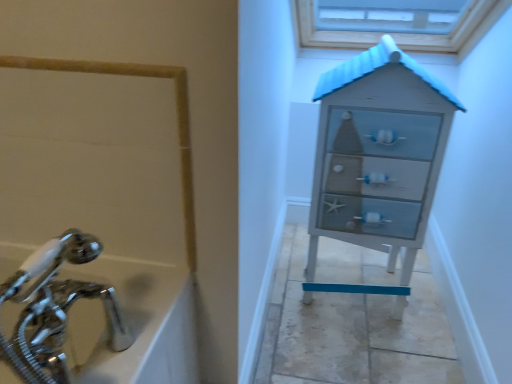
This screenshot has height=384, width=512. Describe the element at coordinates (378, 153) in the screenshot. I see `distressed white chest of drawers at right` at that location.

In order to click on distressed white chest of drawers at right in this screenshot , I will do `click(378, 153)`.

Based on the photo, in order to face chrome metallic faucet at lower left, should I rotate leftwards or rightwards?

Rotate your view left by about 20.718°.

Find the location of `chrome metallic faucet at lower left`. chrome metallic faucet at lower left is located at coordinates (55, 309).

What do you see at coordinates (55, 309) in the screenshot? I see `chrome metallic faucet at lower left` at bounding box center [55, 309].

I want to click on distressed white chest of drawers at right, so click(x=378, y=153).

Is distressed white chest of drawers at right to the left of chrome metallic faucet at lower left from the viewer's perspective?

In fact, distressed white chest of drawers at right is to the right of chrome metallic faucet at lower left.

Who is more distant, distressed white chest of drawers at right or chrome metallic faucet at lower left?

distressed white chest of drawers at right is behind.

Considering the points (326, 194) and (42, 293), which point is behind, point (326, 194) or point (42, 293)?

The point (326, 194) is behind.

From the image's perspective, who appears lower, distressed white chest of drawers at right or chrome metallic faucet at lower left?

chrome metallic faucet at lower left.

Consider the image. From a real-world perspective, does distressed white chest of drawers at right stand above chrome metallic faucet at lower left?

Incorrect, from a real-world perspective, distressed white chest of drawers at right is lower than chrome metallic faucet at lower left.

Considering the sizes of distressed white chest of drawers at right and chrome metallic faucet at lower left in the image, is distressed white chest of drawers at right wider or thinner than chrome metallic faucet at lower left?

distressed white chest of drawers at right is wider than chrome metallic faucet at lower left.

Is distressed white chest of drawers at right taller or shorter than chrome metallic faucet at lower left?

In the image, distressed white chest of drawers at right appears to be taller than chrome metallic faucet at lower left.

Who is smaller, distressed white chest of drawers at right or chrome metallic faucet at lower left?

With smaller size is chrome metallic faucet at lower left.

Is distressed white chest of drawers at right positioned beyond the bounds of chrome metallic faucet at lower left?

Yes, distressed white chest of drawers at right is not within chrome metallic faucet at lower left.

Is distressed white chest of drawers at right touching chrome metallic faucet at lower left?

distressed white chest of drawers at right is not next to chrome metallic faucet at lower left, and they're not touching.

Is distressed white chest of drawers at right oriented towards chrome metallic faucet at lower left?

No, distressed white chest of drawers at right is not aimed at chrome metallic faucet at lower left.

In order to click on tap in front of the distressed white chest of drawers at right in this screenshot , I will do (55, 309).

Can you confirm if chrome metallic faucet at lower left is positioned to the right of distressed white chest of drawers at right?

In fact, chrome metallic faucet at lower left is to the left of distressed white chest of drawers at right.

Is chrome metallic faucet at lower left behind distressed white chest of drawers at right?

No, chrome metallic faucet at lower left is closer to the camera.

Does point (36, 326) lie behind point (317, 238)?

No, (36, 326) is closer to viewer.

From the image's perspective, who appears lower, chrome metallic faucet at lower left or distressed white chest of drawers at right?

chrome metallic faucet at lower left is shown below in the image.

From a real-world perspective, between chrome metallic faucet at lower left and distressed white chest of drawers at right, who is vertically lower?

distressed white chest of drawers at right is physically lower.

Does chrome metallic faucet at lower left have a greater width compared to distressed white chest of drawers at right?

No, chrome metallic faucet at lower left is not wider than distressed white chest of drawers at right.

From their relative heights in the image, would you say chrome metallic faucet at lower left is taller or shorter than distressed white chest of drawers at right?

Clearly, chrome metallic faucet at lower left is shorter compared to distressed white chest of drawers at right.

In terms of size, does chrome metallic faucet at lower left appear bigger or smaller than distressed white chest of drawers at right?

chrome metallic faucet at lower left is smaller than distressed white chest of drawers at right.

Choose the correct answer: Is chrome metallic faucet at lower left inside distressed white chest of drawers at right or outside it?

chrome metallic faucet at lower left lies outside distressed white chest of drawers at right.

Is the surface of chrome metallic faucet at lower left in direct contact with distressed white chest of drawers at right?

chrome metallic faucet at lower left and distressed white chest of drawers at right are not in contact.

Is distressed white chest of drawers at right at the back of chrome metallic faucet at lower left?

No, chrome metallic faucet at lower left's orientation is not away from distressed white chest of drawers at right.

Can you tell me how much chrome metallic faucet at lower left and distressed white chest of drawers at right differ in facing direction?

The angle between the facing direction of chrome metallic faucet at lower left and the facing direction of distressed white chest of drawers at right is 84.9 degrees.

Looking at this image, how far apart are chrome metallic faucet at lower left and distressed white chest of drawers at right?

chrome metallic faucet at lower left is 36.36 inches from distressed white chest of drawers at right.

The image size is (512, 384). In order to click on tap below the distressed white chest of drawers at right (from the image's perspective) in this screenshot , I will do `click(55, 309)`.

At what (x,y) coordinates should I click in order to perform the action: click on tap in front of the distressed white chest of drawers at right. Please return your answer as a coordinate pair (x, y). Looking at the image, I should click on click(55, 309).

At what (x,y) coordinates should I click in order to perform the action: click on chest of drawers above the chrome metallic faucet at lower left (from the image's perspective). Please return your answer as a coordinate pair (x, y). Looking at the image, I should click on (378, 153).